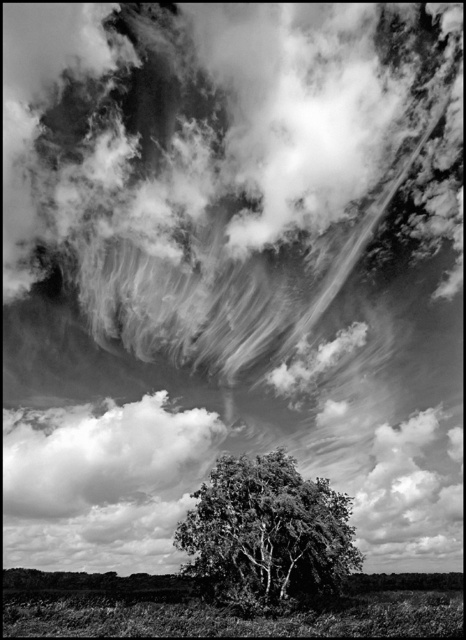
Question: Does green leafy tree at center appear on the right side of cloudy white cloud at lower center?

Choices:
 (A) yes
 (B) no

Answer: (A)

Question: Which of the following is the closest to the observer?

Choices:
 (A) green leafy tree at center
 (B) cloudy white cloud at lower center

Answer: (A)

Question: Is green leafy tree at center bigger than cloudy white cloud at lower center?

Choices:
 (A) yes
 (B) no

Answer: (B)

Question: Is green leafy tree at center smaller than cloudy white cloud at lower center?

Choices:
 (A) no
 (B) yes

Answer: (B)